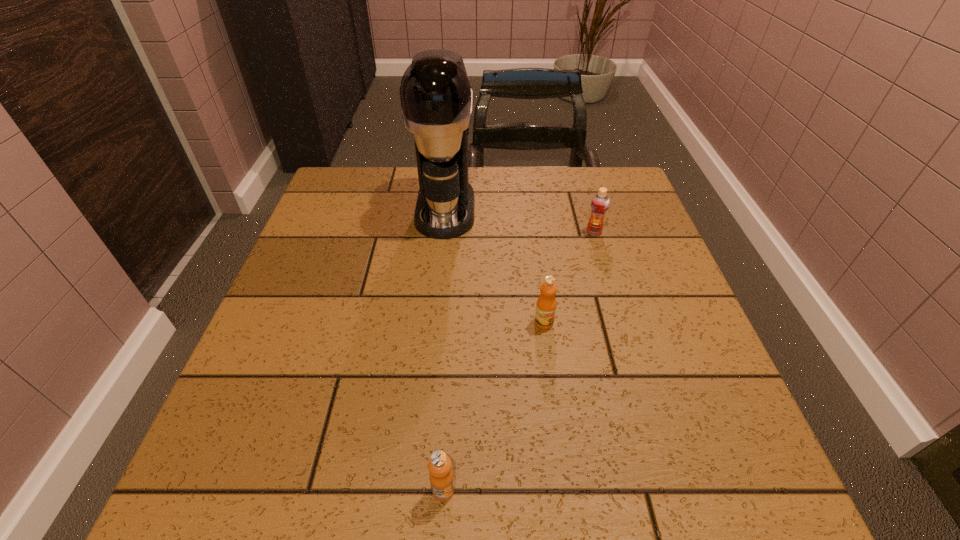
I want to click on object that is at the far edge, so click(436, 98).

Identify the location of object that is positioned at the near edge. (441, 477).

What are the coordinates of `object located at the right edge` in the screenshot? It's located at (600, 202).

Where is `vacant space at the far edge of the desktop`? This screenshot has width=960, height=540. vacant space at the far edge of the desktop is located at coordinates (396, 206).

Find the location of a particular element. blank space at the near edge of the desktop is located at coordinates (364, 471).

This screenshot has width=960, height=540. In the image, there is a desktop. In order to click on vacant space at the left edge in this screenshot , I will do `click(262, 401)`.

The height and width of the screenshot is (540, 960). Identify the location of vacant region at the right edge. (676, 346).

The width and height of the screenshot is (960, 540). In the image, there is a desktop. What are the coordinates of `vacant space at the far left corner` in the screenshot? It's located at (367, 179).

Locate an element on the screen. Image resolution: width=960 pixels, height=540 pixels. vacant point located between the farthest orange juice and the nearest object is located at coordinates (518, 361).

Identify the location of free space between the second farthest orange juice and the nearest object. (493, 406).